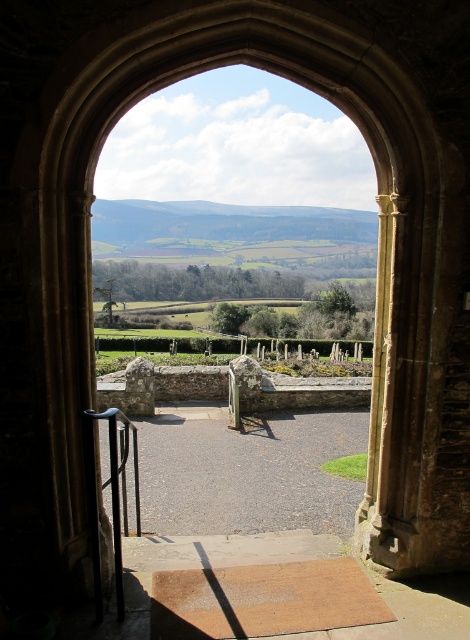
You are a tourist exploring the historic building and want to walk from the entrance to the grassy area outside. The gray gravel path at center and the black metal rail at lower left are in your way. Which object should you step over to reach the grassy area?

You should step over the black metal rail at lower left because the gray gravel path at center is located below it, meaning the rail is higher and blocking the path to the grassy area.

You are standing at the entrance of the arched stone doorway and want to walk towards the grassy area. Which direction should you go relative to the black metal rail at lower left and the gray gravel path at center?

To reach the grassy area, you should go to the right of the black metal rail at lower left since the gray gravel path at center is located to the right of it.

You are a tour guide leading a group through the historical site. You need to direct visitors to the restrooms located beyond the gray gravel path at center and black metal rail at lower left. Which object should they look for first if they want to find the restrooms quickly?

The gray gravel path at center is smaller than the black metal rail at lower left, so visitors should look for the black metal rail at lower left first as it is larger and more noticeable.